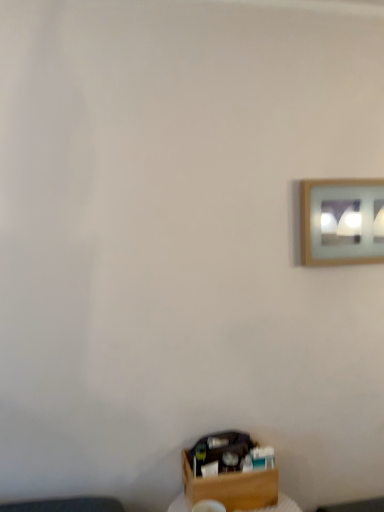
Question: Based on their positions, is wooden frame at upper right located to the left or right of wooden box at lower center?

Choices:
 (A) left
 (B) right

Answer: (B)

Question: Is wooden frame at upper right in front of or behind wooden box at lower center in the image?

Choices:
 (A) behind
 (B) front

Answer: (A)

Question: From a real-world perspective, is wooden frame at upper right positioned above or below wooden box at lower center?

Choices:
 (A) below
 (B) above

Answer: (B)

Question: Is wooden box at lower center wider or thinner than wooden frame at upper right?

Choices:
 (A) wide
 (B) thin

Answer: (A)

Question: From a real-world perspective, is wooden box at lower center physically located above or below wooden frame at upper right?

Choices:
 (A) below
 (B) above

Answer: (A)

Question: In terms of size, does wooden box at lower center appear bigger or smaller than wooden frame at upper right?

Choices:
 (A) big
 (B) small

Answer: (A)

Question: Would you say wooden box at lower center is to the left or to the right of wooden frame at upper right in the picture?

Choices:
 (A) left
 (B) right

Answer: (A)